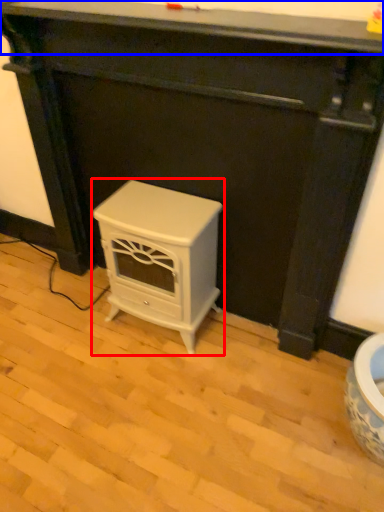
Question: Which object is further to the camera taking this photo, furniture (highlighted by a red box) or counter top (highlighted by a blue box)?

Choices:
 (A) furniture
 (B) counter top

Answer: (A)